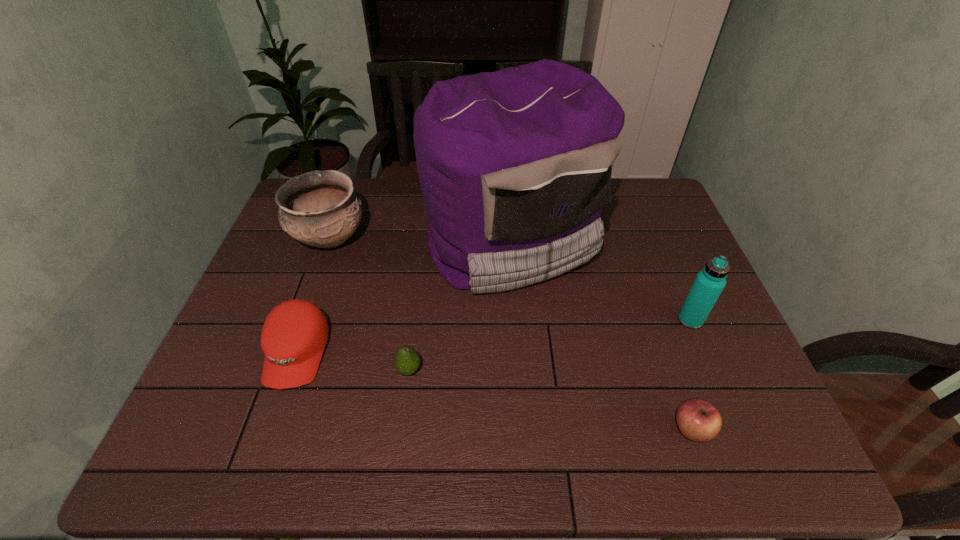
Find the location of a particular element. The height and width of the screenshot is (540, 960). free location located 0.260m on the right of the pottery is located at coordinates (453, 239).

This screenshot has width=960, height=540. What are the coordinates of `vacant area situated 0.120m on the front-facing side of the cap` in the screenshot? It's located at (264, 449).

The width and height of the screenshot is (960, 540). Find the location of `vacant region located on the left of the nearest object`. vacant region located on the left of the nearest object is located at coordinates (522, 430).

Locate an element on the screen. Image resolution: width=960 pixels, height=540 pixels. blank area located 0.330m on the right of the avocado is located at coordinates (565, 370).

The height and width of the screenshot is (540, 960). In order to click on backpack that is at the far edge in this screenshot , I will do `click(515, 166)`.

You are a GUI agent. You are given a task and a screenshot of the screen. Output one action in this format:
    pyautogui.click(x=<x>, y=<y>)
    Task: Click on the pottery positioned at the far edge
    This screenshot has height=540, width=960.
    Given the screenshot: What is the action you would take?
    pyautogui.click(x=319, y=208)

Locate an element on the screen. Image resolution: width=960 pixels, height=540 pixels. object at the near edge is located at coordinates (698, 420).

This screenshot has width=960, height=540. What are the coordinates of `pottery located at the left edge` in the screenshot? It's located at (319, 208).

Where is `cap located in the left edge section of the desktop`? Image resolution: width=960 pixels, height=540 pixels. cap located in the left edge section of the desktop is located at coordinates (294, 335).

This screenshot has width=960, height=540. I want to click on water bottle present at the right edge, so tap(709, 282).